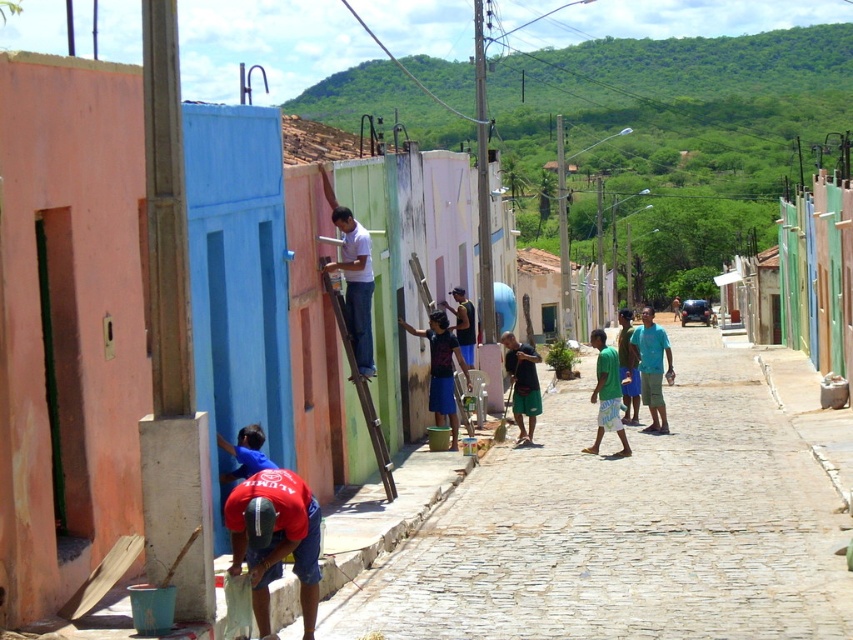
Question: Which point is closer to the camera?

Choices:
 (A) (318, 528)
 (B) (622, 314)
 (C) (358, 376)

Answer: (A)

Question: Which of the following is the farthest from the observer?

Choices:
 (A) (669, 365)
 (B) (521, 433)
 (C) (598, 355)
 (D) (381, 435)

Answer: (A)

Question: Does smooth cobblestone alley at center appear under light blue fabric shirt at center?

Choices:
 (A) yes
 (B) no

Answer: (A)

Question: Can you confirm if light blue fabric shirt at center is positioned above green fabric shirt at center?

Choices:
 (A) yes
 (B) no

Answer: (A)

Question: Is matte blue shirt at center positioned before wooden at center?

Choices:
 (A) no
 (B) yes

Answer: (A)

Question: Which of the following is the farthest from the observer?

Choices:
 (A) (604, 401)
 (B) (332, 192)

Answer: (A)